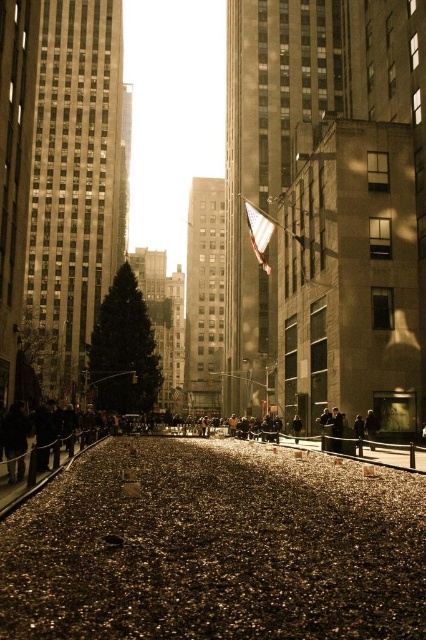
Who is positioned more to the right, dark gray jacket at center or dark brown leather coat at center?

Positioned to the right is dark gray jacket at center.

Which is more to the left, dark gray jacket at center or dark brown leather coat at center?

Positioned to the left is dark brown leather coat at center.

Which is in front, point (357, 440) or point (299, 429)?

Point (357, 440)

What are the coordinates of `dark gray jacket at center` in the screenshot? It's located at (359, 428).

Is dark brown leather jacket at center smaller than dark gray jacket at center?

Incorrect, dark brown leather jacket at center is not smaller in size than dark gray jacket at center.

Can you confirm if dark brown leather jacket at center is positioned to the right of dark gray jacket at center?

Yes, dark brown leather jacket at center is to the right of dark gray jacket at center.

This screenshot has width=426, height=640. What are the coordinates of `dark brown leather jacket at center` in the screenshot? It's located at (371, 426).

Which is in front, point (367, 428) or point (296, 438)?

Point (367, 428)

Is point (373, 440) positioned in front of point (293, 419)?

Yes.

At what (x,y) coordinates should I click in order to perform the action: click on dark brown leather jacket at center. Please return your answer as a coordinate pair (x, y). Looking at the image, I should click on (371, 426).